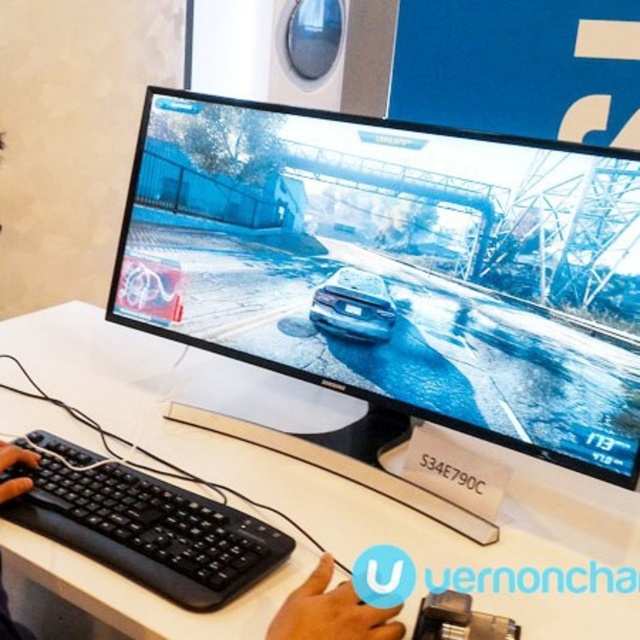
Does satin black monitor at center appear over white plastic computer desk at center?

Yes, satin black monitor at center is above white plastic computer desk at center.

Is point (538, 246) positioned in front of point (36, 547)?

That is False.

Locate an element on the screen. The width and height of the screenshot is (640, 640). satin black monitor at center is located at coordinates (396, 268).

Can you confirm if white plastic computer desk at center is positioned to the left of black plastic keyboard at lower left?

In fact, white plastic computer desk at center is to the right of black plastic keyboard at lower left.

Image resolution: width=640 pixels, height=640 pixels. Describe the element at coordinates (307, 464) in the screenshot. I see `white plastic computer desk at center` at that location.

Between point (60, 312) and point (221, 577), which one is positioned behind?

Point (60, 312)

The height and width of the screenshot is (640, 640). In order to click on white plastic computer desk at center in this screenshot , I will do `click(307, 464)`.

Is satin black monitor at center positioned behind black plastic keyboard at lower left?

Yes, satin black monitor at center is behind black plastic keyboard at lower left.

At what (x,y) coordinates should I click in order to perform the action: click on satin black monitor at center. Please return your answer as a coordinate pair (x, y). This screenshot has height=640, width=640. Looking at the image, I should click on (396, 268).